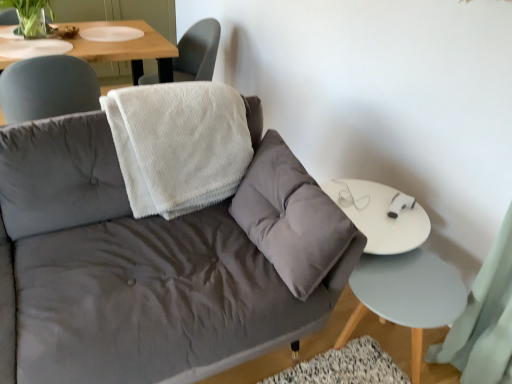
From the picture: In order to face white textured towel at upper center, should I rotate leftwards or rightwards?

Turn left by 10.110 degrees to look at white textured towel at upper center.

What do you see at coordinates (30, 16) in the screenshot?
I see `green matte plant at upper left` at bounding box center [30, 16].

In order to face green matte plant at upper left, should I rotate leftwards or rightwards?

To align with it, rotate left about 27.819°.

Describe the element at coordinates (133, 272) in the screenshot. The height and width of the screenshot is (384, 512). I see `velvet gray couch at center` at that location.

Locate an element on the screen. This screenshot has height=384, width=512. white fluffy blanket at upper center is located at coordinates (179, 145).

From a real-world perspective, which is physically below, green matte plant at upper left or white textured towel at upper center?

In real-world perspective, white textured towel at upper center is lower.

Considering the positions of objects green matte plant at upper left and white textured towel at upper center in the image provided, who is more to the right, green matte plant at upper left or white textured towel at upper center?

Positioned to the right is white textured towel at upper center.

Between green matte plant at upper left and white textured towel at upper center, which one has smaller width?

green matte plant at upper left is thinner.

How many degrees apart are the facing directions of green matte plant at upper left and white textured towel at upper center?

They differ by 91.9 degrees in their facing directions.

In the scene shown: Is green matte plant at upper left at the back of white textured towel at upper center?

No.

What's the angular difference between white textured towel at upper center and green matte plant at upper left's facing directions?

They differ by 91.9 degrees in their facing directions.

Choose the correct answer: Is white textured towel at upper center inside green matte plant at upper left or outside it?

white textured towel at upper center is located beyond the bounds of green matte plant at upper left.

From the image's perspective, which one is positioned higher, white textured towel at upper center or green matte plant at upper left?

green matte plant at upper left is shown above in the image.

From a real-world perspective, is green matte plant at upper left on top of white fluffy blanket at upper center?

Yes.

Is green matte plant at upper left inside or outside of white fluffy blanket at upper center?

green matte plant at upper left exists outside the volume of white fluffy blanket at upper center.

Is green matte plant at upper left smaller than white fluffy blanket at upper center?

Yes, green matte plant at upper left is smaller than white fluffy blanket at upper center.

Is point (147, 177) farther from camera compared to point (261, 335)?

Yes, point (147, 177) is behind point (261, 335).

From the picture: From the image's perspective, is white fluffy blanket at upper center located above or below velvet gray couch at center?

white fluffy blanket at upper center is situated higher than velvet gray couch at center in the image.

Is white fluffy blanket at upper center placed right next to velvet gray couch at center?

No.

In order to click on side table that is under the green matte plant at upper left (from a real-world perspective) in this screenshot , I will do `click(406, 295)`.

Is light blue wood side table at lower right oriented away from green matte plant at upper left?

Yes, light blue wood side table at lower right is facing away from green matte plant at upper left.

Consider the image. Is light blue wood side table at lower right not inside green matte plant at upper left?

Yes, light blue wood side table at lower right is outside of green matte plant at upper left.

In the scene shown: Which is in front, light blue wood side table at lower right or green matte plant at upper left?

light blue wood side table at lower right is more forward.

Which object is further away from the camera taking this photo, white textured towel at upper center or white fluffy blanket at upper center?

Positioned behind is white textured towel at upper center.

In terms of size, does white textured towel at upper center appear bigger or smaller than white fluffy blanket at upper center?

Clearly, white textured towel at upper center is smaller in size than white fluffy blanket at upper center.

From a real-world perspective, is white textured towel at upper center physically above white fluffy blanket at upper center?

Actually, white textured towel at upper center is physically below white fluffy blanket at upper center in the real world.

Is light blue wood side table at lower right aimed at white fluffy blanket at upper center?

No, light blue wood side table at lower right is not turned towards white fluffy blanket at upper center.

From the image's perspective, which one is positioned higher, light blue wood side table at lower right or white fluffy blanket at upper center?

From the image's view, white fluffy blanket at upper center is above.

Would you say light blue wood side table at lower right is a long distance from white fluffy blanket at upper center?

light blue wood side table at lower right is actually quite close to white fluffy blanket at upper center.

This screenshot has height=384, width=512. Find the location of `chair that appears below the green matte plant at upper left (from a real-world perspective)`. chair that appears below the green matte plant at upper left (from a real-world perspective) is located at coordinates (197, 52).

Identify the location of chair located on the right of green matte plant at upper left. (197, 52).

Looking at the image, which one is located closer to green matte plant at upper left, white fluffy blanket at upper center or velvet gray couch at center?

white fluffy blanket at upper center is positioned closer to the anchor green matte plant at upper left.

Based on their spatial positions, is light blue wood side table at lower right or white fluffy blanket at upper center further from green matte plant at upper left?

light blue wood side table at lower right lies further to green matte plant at upper left than the other object.

In the scene shown: Based on their spatial positions, is green matte plant at upper left or white textured towel at upper center closer to velvet gray couch at center?

white textured towel at upper center is closer to velvet gray couch at center.

Which object lies further to the anchor point light blue wood side table at lower right, green matte plant at upper left or white textured towel at upper center?

Among the two, green matte plant at upper left is located further to light blue wood side table at lower right.

Based on their spatial positions, is green matte plant at upper left or white fluffy blanket at upper center closer to white textured towel at upper center?

green matte plant at upper left lies closer to white textured towel at upper center than the other object.

Estimate the real-world distances between objects in this image. Which object is further from light blue wood side table at lower right, velvet gray couch at center or white fluffy blanket at upper center?

white fluffy blanket at upper center.

Which object lies further to the anchor point velvet gray couch at center, green matte plant at upper left or light blue wood side table at lower right?

Based on the image, green matte plant at upper left appears to be further to velvet gray couch at center.

When comparing their distances from light blue wood side table at lower right, does white textured towel at upper center or white fluffy blanket at upper center seem further?

white textured towel at upper center is positioned further to the anchor light blue wood side table at lower right.

At what (x,y) coordinates should I click in order to perform the action: click on blanket positioned between velvet gray couch at center and white textured towel at upper center from near to far. Please return your answer as a coordinate pair (x, y). Image resolution: width=512 pixels, height=384 pixels. Looking at the image, I should click on (179, 145).

Where is `blanket situated between green matte plant at upper left and light blue wood side table at lower right from left to right`? The width and height of the screenshot is (512, 384). blanket situated between green matte plant at upper left and light blue wood side table at lower right from left to right is located at coordinates (179, 145).

What are the coordinates of `plant between white fluffy blanket at upper center and white textured towel at upper center from front to back` in the screenshot? It's located at (30, 16).

What are the coordinates of `blanket between velvet gray couch at center and light blue wood side table at lower right in the horizontal direction` in the screenshot? It's located at (179, 145).